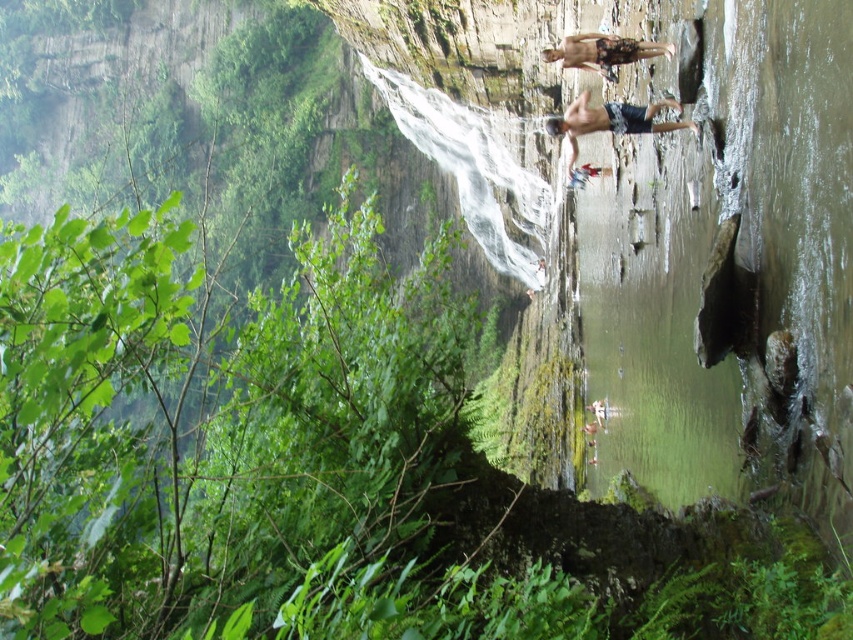
You are a hiker planning to climb the cliff where the smooth skin rock climber at upper right and the camouflage shorts at upper center are located. Which object is higher up the cliff?

The smooth skin rock climber at upper right is higher up the cliff compared to the camouflage shorts at upper center because it has a greater height.

You are planning to take a photo of the waterfall and want to include the smooth skin rock climber at upper right in your shot. Based on their position, where should you position yourself to capture both the waterfall and the climber in the frame?

To capture both the waterfall and the smooth skin rock climber at upper right in your frame, position yourself in a spot that allows you to see the waterfall centrally while the climber is positioned towards the upper right corner of your viewfinder. This placement aligns with their location at coordinates approximately 0.189 on the x and 0.717 on the y axis, ensuring both elements are included in the shot.